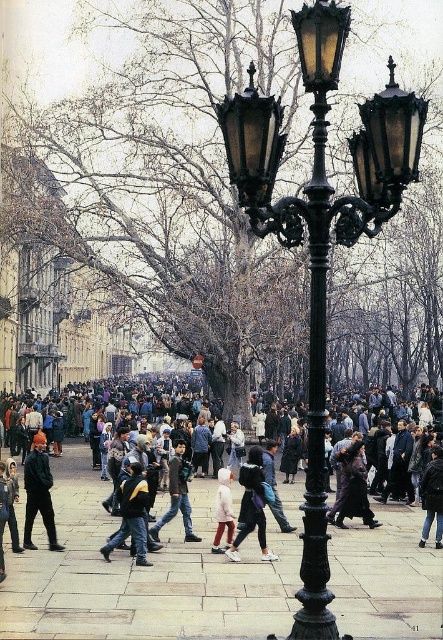
Question: In this image, where is dark gray jacket at lower left located relative to light pink fabric pants at center?

Choices:
 (A) below
 (B) above

Answer: (B)

Question: Does dark blue backpack at center have a greater width compared to dark brown leather jacket at center?

Choices:
 (A) yes
 (B) no

Answer: (B)

Question: Which object is positioned farthest from the black wrought iron street light at center?

Choices:
 (A) dark gray jacket at lower left
 (B) dark blue jacket at center
 (C) smooth stone pavement at center
 (D) dark brown leather jacket at center

Answer: (A)

Question: Does black wrought iron street light at center appear on the left side of dark blue backpack at center?

Choices:
 (A) yes
 (B) no

Answer: (B)

Question: Which point is closer to the camera?

Choices:
 (A) black wrought iron street light at center
 (B) light pink fabric pants at center

Answer: (A)

Question: Estimate the real-world distances between objects in this image. Which object is farther from the smooth stone pavement at center?

Choices:
 (A) dark gray jacket at lower left
 (B) dark blue backpack at center
 (C) light pink fabric pants at center

Answer: (A)